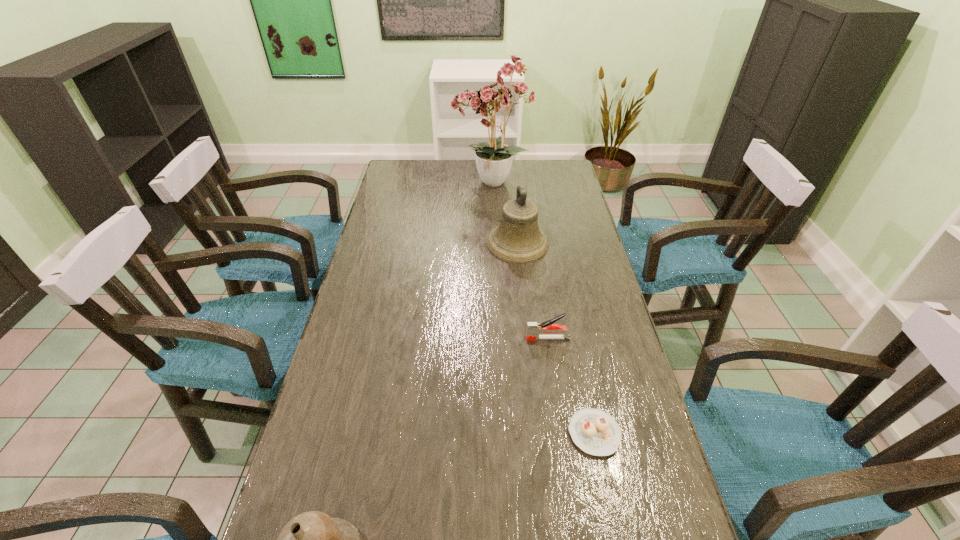
This screenshot has height=540, width=960. What are the coordinates of `flower arrangement` in the screenshot? It's located at (493, 101).

Where is `the tallest object`? the tallest object is located at coordinates (493, 101).

This screenshot has height=540, width=960. Find the location of `the second tallest object`. the second tallest object is located at coordinates (518, 239).

Locate an element on the screen. The height and width of the screenshot is (540, 960). the right bell is located at coordinates click(518, 239).

Locate an element on the screen. The width and height of the screenshot is (960, 540). stapler is located at coordinates (534, 329).

Where is `the second shortest object`? This screenshot has height=540, width=960. the second shortest object is located at coordinates (534, 329).

Where is `cupcake`? This screenshot has width=960, height=540. cupcake is located at coordinates [x=595, y=432].

Find the location of `the shortest object`. the shortest object is located at coordinates (595, 432).

Where is `vacant space located on the front-facing side of the flower arrangement`? This screenshot has height=540, width=960. vacant space located on the front-facing side of the flower arrangement is located at coordinates (390, 184).

Where is `free point located on the front-facing side of the flower arrangement`? free point located on the front-facing side of the flower arrangement is located at coordinates (421, 184).